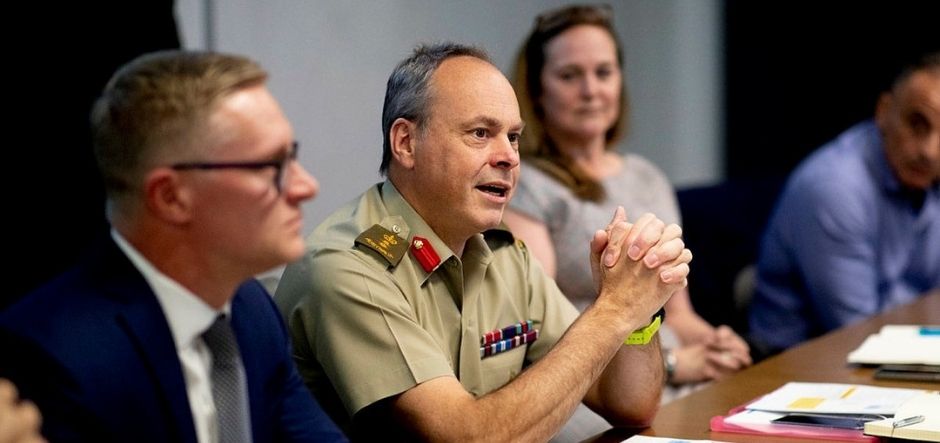
Locate an element on the screen. This screenshot has width=940, height=443. table is located at coordinates (815, 367).